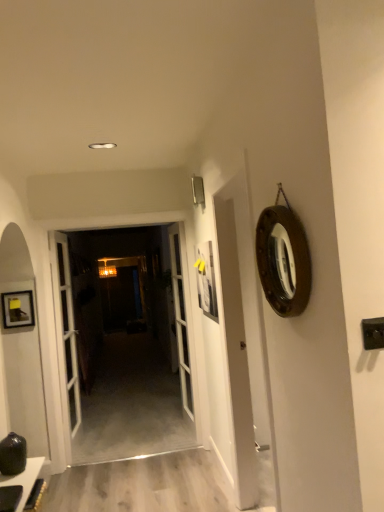
Describe the element at coordinates (283, 260) in the screenshot. I see `wooden-framed mirror at upper right` at that location.

The height and width of the screenshot is (512, 384). What are the coordinates of `wooden-framed mirror at upper right` in the screenshot? It's located at (283, 260).

The height and width of the screenshot is (512, 384). Describe the element at coordinates (65, 327) in the screenshot. I see `white glass door at center, the 3th door when ordered from right to left` at that location.

Image resolution: width=384 pixels, height=512 pixels. What do you see at coordinates (123, 346) in the screenshot? I see `white glass door at center, which appears as the 2th door when viewed from the right` at bounding box center [123, 346].

Measure the distance between white glass door at center, the 2th door in the left-to-right sequence, and camera.

white glass door at center, the 2th door in the left-to-right sequence, is 3.58 meters away from camera.

Locate an element on the screen. smooth gray carpet at center is located at coordinates (142, 485).

Locate an element on the screen. The image size is (384, 512). wooden-framed mirror at upper right is located at coordinates (283, 260).

Where is `path located below the matte black table at lower left (from the image's perspective)`? This screenshot has width=384, height=512. path located below the matte black table at lower left (from the image's perspective) is located at coordinates (142, 485).

From the image's perspective, relative to smooth gray carpet at center, is matte black table at lower left above or below?

matte black table at lower left is situated higher than smooth gray carpet at center in the image.

Between matte black table at lower left and smooth gray carpet at center, which one has larger width?

smooth gray carpet at center is wider.

Can you confirm if matte black table at lower left is smaller than wooden-framed mirror at upper right?

Yes.

Which is more to the right, matte black table at lower left or wooden-framed mirror at upper right?

Positioned to the right is wooden-framed mirror at upper right.

How many degrees apart are the facing directions of matte black table at lower left and wooden-framed mirror at upper right?

They differ by 180 degrees in their facing directions.

Is wooden-framed mirror at upper right positioned behind white glass door at center, the 2th door in the left-to-right sequence?

No.

Is wooden-framed mirror at upper right directly adjacent to white glass door at center, which appears as the 2th door when viewed from the right?

No, wooden-framed mirror at upper right is not touching white glass door at center, which appears as the 2th door when viewed from the right.

From the image's perspective, is wooden-framed mirror at upper right below white glass door at center, the 2th door in the left-to-right sequence?

Actually, wooden-framed mirror at upper right appears above white glass door at center, the 2th door in the left-to-right sequence, in the image.

Considering the sizes of objects matte black table at lower left and white glass door at center, the 2th door in the left-to-right sequence, in the image provided, who is taller, matte black table at lower left or white glass door at center, the 2th door in the left-to-right sequence,?

Standing taller between the two is white glass door at center, the 2th door in the left-to-right sequence.

From a real-world perspective, is matte black table at lower left over white glass door at center, which appears as the 2th door when viewed from the right?

Incorrect, from a real-world perspective, matte black table at lower left is lower than white glass door at center, which appears as the 2th door when viewed from the right.

Which of these two, matte black table at lower left or white glass door at center, which appears as the 2th door when viewed from the right, is wider?

matte black table at lower left.

Is point (33, 459) farther from viewer compared to point (113, 259)?

No, it is not.

From the image's perspective, which one is positioned higher, white glass door at center, the 2th door in the left-to-right sequence, or white glass door at center, the 3th door when ordered from right to left?

white glass door at center, the 2th door in the left-to-right sequence, from the image's perspective.

From their relative heights in the image, would you say white glass door at center, which appears as the 2th door when viewed from the right, is taller or shorter than white glass door at center, which is counted as the 1th door, starting from the left?

Clearly, white glass door at center, which appears as the 2th door when viewed from the right, is shorter compared to white glass door at center, which is counted as the 1th door, starting from the left.

Measure the distance from white glass door at center, the 2th door in the left-to-right sequence, to white glass door at center, the 3th door when ordered from right to left.

They are 18.65 inches apart.

Is white glass door at center, the 2th door in the left-to-right sequence, far away from white glass door at center, which is counted as the 1th door, starting from the left?

No, white glass door at center, the 2th door in the left-to-right sequence, is not far from white glass door at center, which is counted as the 1th door, starting from the left.

In the scene shown: Which object is positioned more to the right, wooden-framed mirror at upper right or smooth gray carpet at center?

wooden-framed mirror at upper right.

Is point (300, 301) positioned in front of point (46, 505)?

Yes, point (300, 301) is closer to viewer.

Is wooden-framed mirror at upper right behind smooth gray carpet at center?

No, the depth of wooden-framed mirror at upper right is less than that of smooth gray carpet at center.

Is wooden-framed mirror at upper right next to smooth gray carpet at center?

wooden-framed mirror at upper right and smooth gray carpet at center are clearly separated.

Considering the relative positions of smooth gray carpet at center and wooden-framed mirror at upper right in the image provided, is smooth gray carpet at center to the right of wooden-framed mirror at upper right from the viewer's perspective?

Incorrect, smooth gray carpet at center is not on the right side of wooden-framed mirror at upper right.

From a real-world perspective, is smooth gray carpet at center over wooden-framed mirror at upper right?

No, from a real-world perspective, smooth gray carpet at center is not over wooden-framed mirror at upper right

Is smooth gray carpet at center facing towards wooden-framed mirror at upper right?

No, smooth gray carpet at center is not aimed at wooden-framed mirror at upper right.

I want to click on path behind the wooden-framed mirror at upper right, so click(142, 485).

At what (x,y) coordinates should I click in order to perform the action: click on table that appears on the left of smooth gray carpet at center. Please return your answer as a coordinate pair (x, y). The image size is (384, 512). Looking at the image, I should click on (25, 479).

The image size is (384, 512). What are the coordinates of `oval above the matte black table at lower left (from a real-world perspective)` in the screenshot? It's located at (283, 260).

Looking at the image, which one is located closer to wooden-framed mirror at upper right, white glass door at center, the 2th door in the left-to-right sequence, or matte black table at lower left?

Among the two, matte black table at lower left is located nearer to wooden-framed mirror at upper right.

Estimate the real-world distances between objects in this image. Which object is further from wooden-framed mirror at upper right, white glass door at center, acting as the 1th door starting from the right, or white glass door at center, the 2th door in the left-to-right sequence?

white glass door at center, the 2th door in the left-to-right sequence.

Considering their positions, is matte black table at lower left positioned closer to white glass door at center, marked as the third door in a left-to-right arrangement, than wooden-framed mirror at upper right?

matte black table at lower left is positioned closer to the anchor white glass door at center, marked as the third door in a left-to-right arrangement.

When comparing their distances from matte black table at lower left, does smooth gray carpet at center or wooden-framed mirror at upper right seem further?

wooden-framed mirror at upper right.

Considering their positions, is white glass door at center, which appears as the 2th door when viewed from the right, positioned closer to smooth gray carpet at center than white glass door at center, acting as the 1th door starting from the right?

Among the two, white glass door at center, acting as the 1th door starting from the right, is located nearer to smooth gray carpet at center.

Considering their positions, is matte black table at lower left positioned further to wooden-framed mirror at upper right than smooth gray carpet at center?

smooth gray carpet at center is positioned further to the anchor wooden-framed mirror at upper right.

Considering their positions, is smooth gray carpet at center positioned closer to white glass door at center, which is counted as the 1th door, starting from the left, than white glass door at center, which appears as the 2th door when viewed from the right?

white glass door at center, which appears as the 2th door when viewed from the right, is closer to white glass door at center, which is counted as the 1th door, starting from the left.

Looking at the image, which one is located closer to white glass door at center, the 2th door in the left-to-right sequence, wooden-framed mirror at upper right or white glass door at center, marked as the third door in a left-to-right arrangement?

white glass door at center, marked as the third door in a left-to-right arrangement, is closer to white glass door at center, the 2th door in the left-to-right sequence.

Where is `door located between wooden-framed mirror at upper right and white glass door at center, which appears as the 2th door when viewed from the right, in the depth direction`? The height and width of the screenshot is (512, 384). door located between wooden-framed mirror at upper right and white glass door at center, which appears as the 2th door when viewed from the right, in the depth direction is located at coordinates point(65,327).

Image resolution: width=384 pixels, height=512 pixels. In order to click on door positioned between matte black table at lower left and white glass door at center, the 2th door in the left-to-right sequence, from near to far in this screenshot , I will do click(x=65, y=327).

The height and width of the screenshot is (512, 384). Identify the location of door between smooth gray carpet at center and white glass door at center, the 2th door in the left-to-right sequence, from front to back. (65, 327).

Identify the location of table between wooden-framed mirror at upper right and white glass door at center, which appears as the 2th door when viewed from the right, from front to back. The width and height of the screenshot is (384, 512). (25, 479).